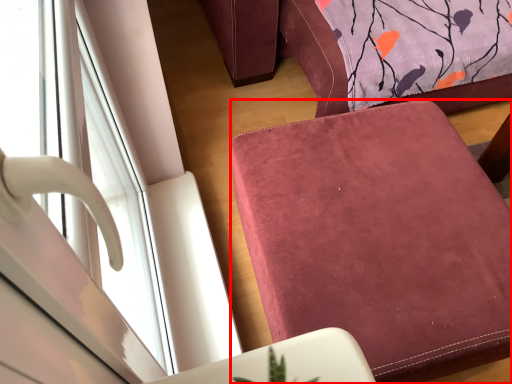
Question: Considering the relative positions of furniture (annotated by the red box) and window in the image provided, where is furniture (annotated by the red box) located with respect to the staircase?

Choices:
 (A) right
 (B) left

Answer: (A)